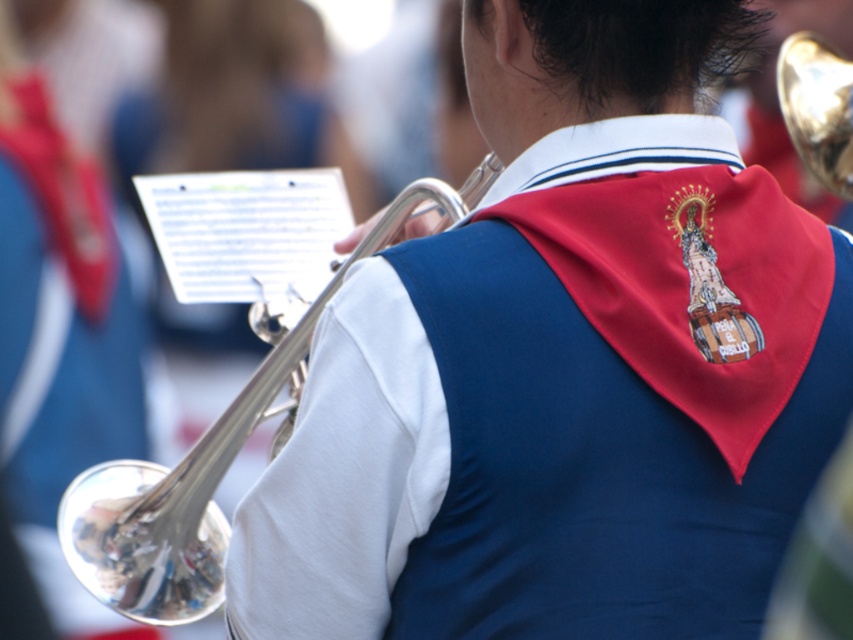
You are a photographer trying to capture the reflection on the shiny brass trumpet at upper right and the silver polished trumpet at left. Which trumpet should you position closer to the light source to ensure its reflection is more prominent?

The silver polished trumpet at left should be positioned closer to the light source because it is to the left of the shiny brass trumpet at upper right, making it closer to the light source.

You are a photographer trying to capture the metallic blue vest at center and the shiny brass trumpet at upper right in a single frame. Based on their positions, which object should you focus on first to ensure both are in the frame?

The metallic blue vest at center is below the shiny brass trumpet at upper right, so you should focus on the shiny brass trumpet at upper right first to ensure both are in the frame.